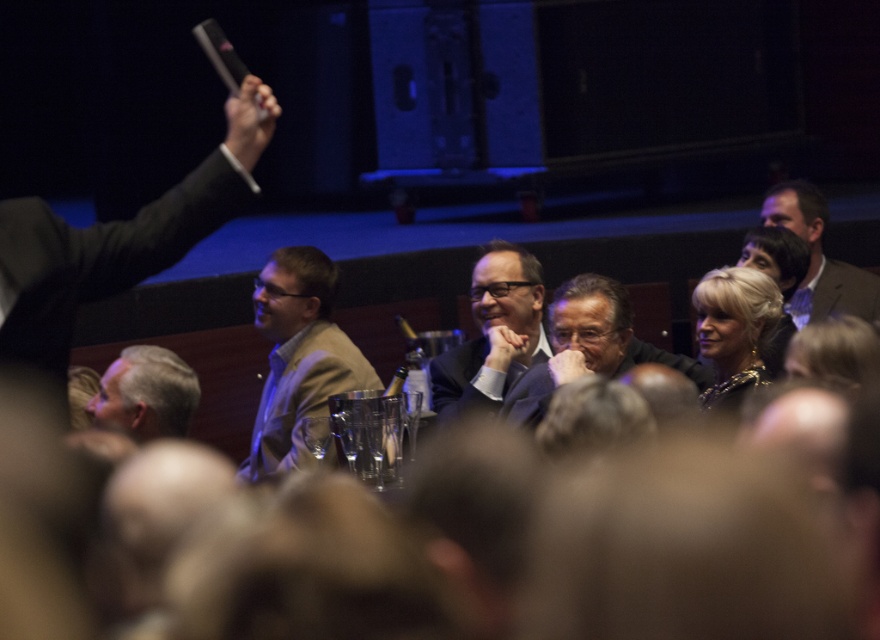
Question: Is matte black suit at center in front of brown textured suit at right?

Choices:
 (A) yes
 (B) no

Answer: (A)

Question: Can you confirm if matte beige jacket at center is positioned above brown textured suit at right?

Choices:
 (A) yes
 (B) no

Answer: (B)

Question: Which point appears closest to the camera in this image?

Choices:
 (A) coord(780,189)
 (B) coord(435,358)

Answer: (B)

Question: Estimate the real-world distances between objects in this image. Which object is closer to the brown textured suit at right?

Choices:
 (A) matte beige jacket at center
 (B) matte black suit at left
 (C) matte black suit at center
 (D) shiny gold necklace at center

Answer: (D)

Question: Which point appears farthest from the camera in this image?

Choices:
 (A) (591, 362)
 (B) (458, 362)
 (C) (871, 298)

Answer: (C)

Question: Does dark gray suit at center have a smaller size compared to gray fabric suit at lower left?

Choices:
 (A) no
 (B) yes

Answer: (A)